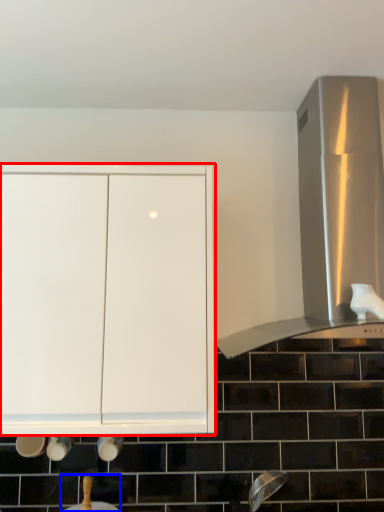
Question: Among these objects, which one is nearest to the camera, cabinetry (highlighted by a red box) or sink (highlighted by a blue box)?

Choices:
 (A) cabinetry
 (B) sink

Answer: (A)